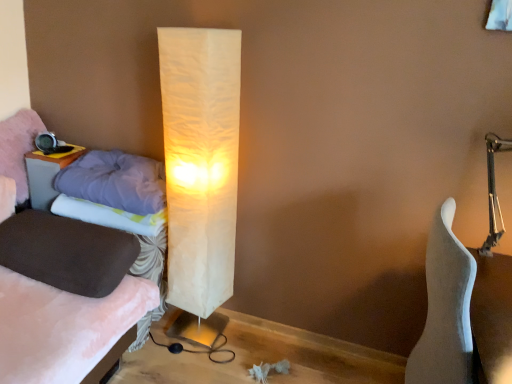
Question: Could you tell me if velvet purple pillow at left, the 1th pillow viewed from the top, is facing suede-like brown pillow at left, arranged as the 4th pillow when viewed from the top?

Choices:
 (A) no
 (B) yes

Answer: (A)

Question: Considering the relative sizes of velvet purple pillow at left, the fourth pillow positioned from the bottom, and suede-like brown pillow at left, arranged as the 4th pillow when viewed from the top, in the image provided, is velvet purple pillow at left, the fourth pillow positioned from the bottom, thinner than suede-like brown pillow at left, arranged as the 4th pillow when viewed from the top,?

Choices:
 (A) yes
 (B) no

Answer: (A)

Question: Considering the relative positions of velvet purple pillow at left, the 1th pillow viewed from the top, and suede-like brown pillow at left, arranged as the 4th pillow when viewed from the top, in the image provided, is velvet purple pillow at left, the 1th pillow viewed from the top, to the right of suede-like brown pillow at left, arranged as the 4th pillow when viewed from the top, from the viewer's perspective?

Choices:
 (A) yes
 (B) no

Answer: (B)

Question: Can we say velvet purple pillow at left, the 1th pillow viewed from the top, lies outside suede-like brown pillow at left, arranged as the 4th pillow when viewed from the top?

Choices:
 (A) yes
 (B) no

Answer: (A)

Question: Is velvet purple pillow at left, the 1th pillow viewed from the top, in contact with suede-like brown pillow at left, arranged as the 4th pillow when viewed from the top?

Choices:
 (A) yes
 (B) no

Answer: (B)

Question: Is velvet purple pillow at left, the fourth pillow positioned from the bottom, facing away from suede-like brown pillow at left, which appears as the 1th pillow when ordered from the bottom?

Choices:
 (A) no
 (B) yes

Answer: (A)

Question: Is matte wood table at left further to the viewer compared to fluffy purple pillow at left, acting as the 2th pillow starting from the top?

Choices:
 (A) no
 (B) yes

Answer: (B)

Question: Considering the relative sizes of matte wood table at left and fluffy purple pillow at left, acting as the 2th pillow starting from the top, in the image provided, is matte wood table at left shorter than fluffy purple pillow at left, acting as the 2th pillow starting from the top,?

Choices:
 (A) yes
 (B) no

Answer: (B)

Question: Is matte wood table at left looking in the opposite direction of fluffy purple pillow at left, which is the 3th pillow in bottom-to-top order?

Choices:
 (A) yes
 (B) no

Answer: (B)

Question: Is matte wood table at left bigger than fluffy purple pillow at left, acting as the 2th pillow starting from the top?

Choices:
 (A) no
 (B) yes

Answer: (A)

Question: Can you confirm if matte wood table at left is smaller than fluffy purple pillow at left, acting as the 2th pillow starting from the top?

Choices:
 (A) yes
 (B) no

Answer: (A)

Question: Is matte wood table at left outside of fluffy purple pillow at left, acting as the 2th pillow starting from the top?

Choices:
 (A) no
 (B) yes

Answer: (B)

Question: Does matte wood table at left have a greater height compared to white matte guitar at right?

Choices:
 (A) no
 (B) yes

Answer: (A)